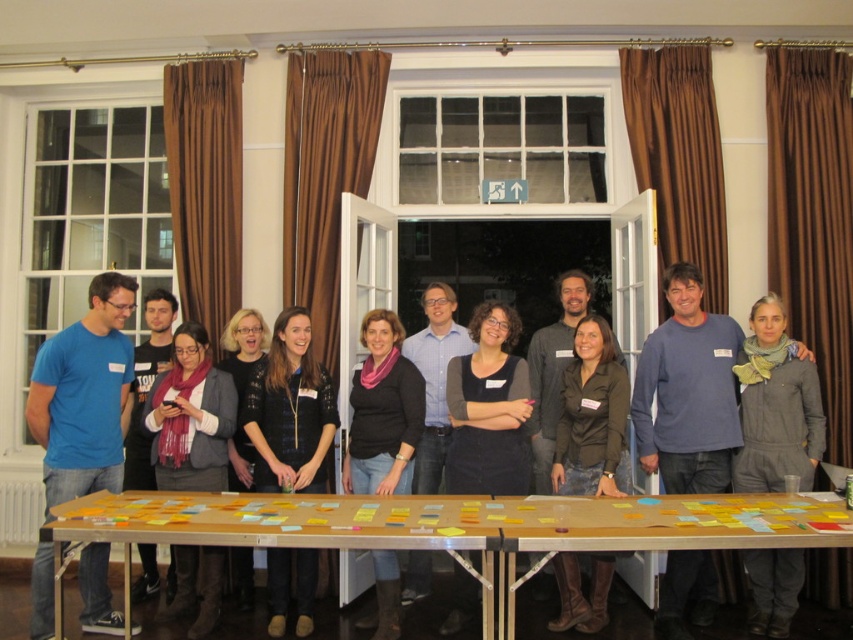
Is wooden table at center smaller than gray woolen jacket at lower right?

Actually, wooden table at center might be larger than gray woolen jacket at lower right.

Is wooden table at center above gray woolen jacket at lower right?

Actually, wooden table at center is below gray woolen jacket at lower right.

Does point (625, 548) come farther from viewer compared to point (753, 324)?

No, (625, 548) is closer to viewer.

This screenshot has width=853, height=640. In order to click on wooden table at center in this screenshot , I will do `click(451, 525)`.

Is point (396, 320) more distant than point (122, 620)?

Yes, it is.

Is blue cotton shirt at center thinner than blue t-shirt at left?

In fact, blue cotton shirt at center might be wider than blue t-shirt at left.

Is point (190, 547) farther from camera compared to point (106, 284)?

Yes, point (190, 547) is behind point (106, 284).

Find the location of a particular element. blue cotton shirt at center is located at coordinates (131, 561).

Can you confirm if wooden table at center is positioned above blue cotton shirt at center?

Actually, wooden table at center is below blue cotton shirt at center.

Who is shorter, wooden table at center or blue cotton shirt at center?

With less height is wooden table at center.

Is point (434, 544) closer to camera compared to point (178, 356)?

Yes, point (434, 544) is closer to viewer.

Identify the location of wooden table at center. The width and height of the screenshot is (853, 640). (451, 525).